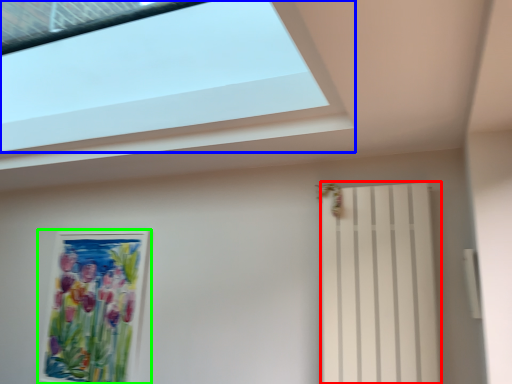
Question: Which object is positioned farthest from shutter (highlighted by a red box)? Select from window (highlighted by a blue box) and picture frame (highlighted by a green box).

Choices:
 (A) window
 (B) picture frame

Answer: (B)